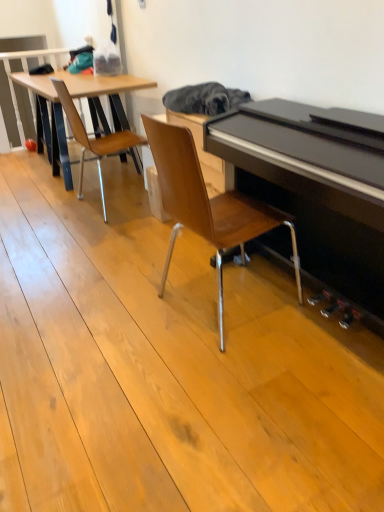
Question: Would you say wooden chair at center, which appears as the 2th chair when viewed from the back, is inside or outside wooden chair at left, which is the 1th chair from back to front?

Choices:
 (A) outside
 (B) inside

Answer: (A)

Question: Is point (264, 204) positioned closer to the camera than point (119, 151)?

Choices:
 (A) closer
 (B) farther

Answer: (A)

Question: From the image's perspective, is wooden chair at center, which appears as the second chair when viewed from the left, located above or below wooden chair at left, which is the 1th chair from back to front?

Choices:
 (A) above
 (B) below

Answer: (B)

Question: Is wooden chair at left, which is the 1th chair from back to front, inside the boundaries of wooden chair at center, arranged as the 1th chair when viewed from the right, or outside?

Choices:
 (A) inside
 (B) outside

Answer: (B)

Question: From a real-world perspective, is wooden chair at left, which is the 1th chair from back to front, positioned above or below wooden chair at center, which appears as the second chair when viewed from the left?

Choices:
 (A) below
 (B) above

Answer: (A)

Question: Is point (105, 153) positioned closer to the camera than point (225, 197)?

Choices:
 (A) farther
 (B) closer

Answer: (A)

Question: Looking at the image, does wooden chair at left, which is the 1th chair from back to front, seem bigger or smaller compared to wooden chair at center, which is the first chair from front to back?

Choices:
 (A) big
 (B) small

Answer: (B)